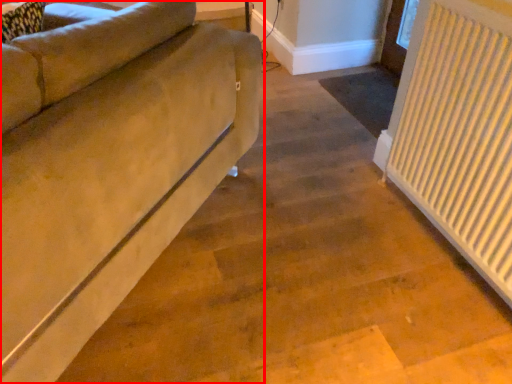
Question: From the image, what is the correct spatial relationship of studio couch (annotated by the red box) in relation to radiator?

Choices:
 (A) left
 (B) right

Answer: (A)